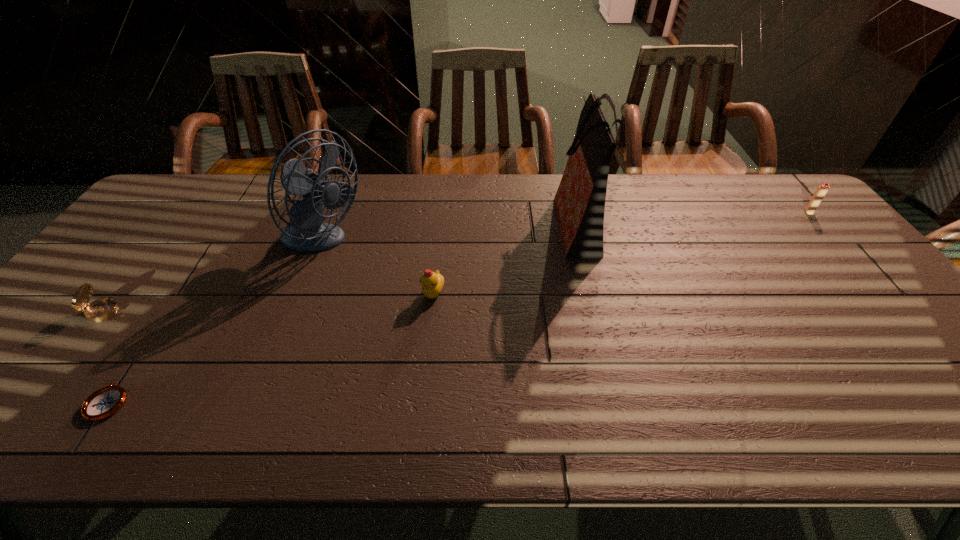
Where is `object at the right edge`? The image size is (960, 540). object at the right edge is located at coordinates (821, 191).

Where is `object located at the far right corner`? object located at the far right corner is located at coordinates (821, 191).

This screenshot has width=960, height=540. In the image, there is a desktop. Identify the location of vacant region at the far edge. (654, 191).

Image resolution: width=960 pixels, height=540 pixels. I want to click on blank space at the near edge of the desktop, so click(x=905, y=407).

You are a GUI agent. You are given a task and a screenshot of the screen. Output one action in this format:
    pyautogui.click(x=<x>, y=<y>)
    Task: Click on the free region at the left edge
    
    Given the screenshot: What is the action you would take?
    pyautogui.click(x=133, y=226)

The image size is (960, 540). I want to click on vacant space at the far left corner, so click(x=182, y=200).

Image resolution: width=960 pixels, height=540 pixels. Find the location of `free location at the far right corner`. free location at the far right corner is located at coordinates (767, 177).

At what (x,y) coordinates should I click in order to perform the action: click on free space between the left compass and the rightmost object. Please return your answer as a coordinate pair (x, y). This screenshot has height=540, width=960. Looking at the image, I should click on (457, 262).

Find the location of a particular element. The height and width of the screenshot is (540, 960). empty space between the shopping bag and the taller compass is located at coordinates (342, 267).

Locate an element on the screen. The width and height of the screenshot is (960, 540). vacant space that's between the second object from right to left and the rightmost object is located at coordinates (693, 217).